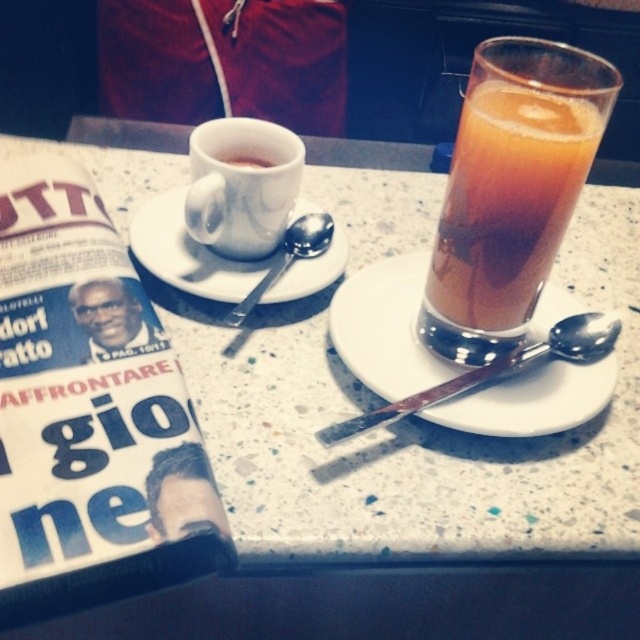
You are standing at a distance and looking at the dining setup. There is a point marked at coordinates point (220,163). Can you reach this point without moving closer than 17 inches?

The point (220,163) is 17.36 inches away from the viewer. Since 17.36 inches is just slightly more than 17 inches, you cannot reach it without moving closer than 17 inches.

You are standing in front of the dining table and want to reach the point marked at coordinates point [440,296]. If your hand can extend 15 inches, will you be able to reach it?

The distance between you and the point [440,296] is 16.61 inches, which is slightly beyond your hand extension of 15 inches. Therefore, you cannot reach it.

You are a waiter in a cafe and need to place a new order on the table. The customer has requested a hot beverage and a cold beverage. The table already has a translucent glass beverage at upper right. Where should you place the new items to avoid blocking the existing beverage?

Place the new items away from the translucent glass beverage at upper right, ensuring they are not near its position at point (509, 189) to avoid blocking it.